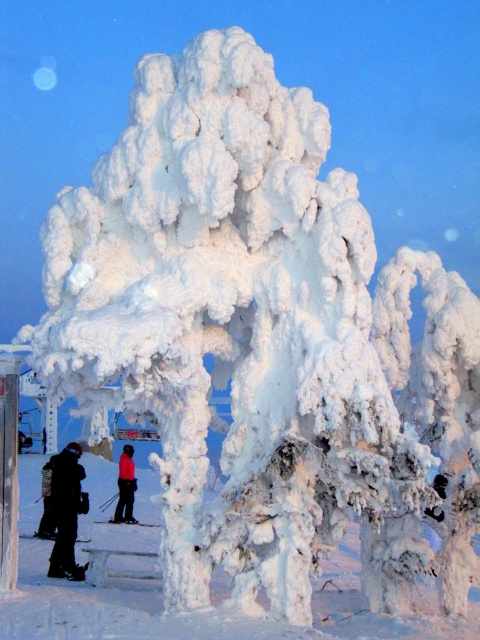
Which of these two, white frosty trees at center or black matte snowboarder at lower left, stands shorter?

With less height is black matte snowboarder at lower left.

Who is lower down, white frosty trees at center or black matte snowboarder at lower left?

white frosty trees at center is lower down.

Image resolution: width=480 pixels, height=640 pixels. Find the location of `white frosty trees at center`. white frosty trees at center is located at coordinates (204, 611).

Is point (74, 504) positioned before point (127, 461)?

Yes, point (74, 504) is in front of point (127, 461).

Which is above, black matte snowboarder at lower left or red fabric skier at center?

Positioned higher is black matte snowboarder at lower left.

The height and width of the screenshot is (640, 480). What do you see at coordinates (66, 509) in the screenshot? I see `black matte snowboarder at lower left` at bounding box center [66, 509].

Find the location of a particular element. Image resolution: width=480 pixels, height=640 pixels. black matte snowboarder at lower left is located at coordinates (66, 509).

Measure the distance between white frosty trees at center and camera.

They are 31.76 feet apart.

Is point (354, 616) farther from camera compared to point (124, 480)?

No, (354, 616) is closer to viewer.

This screenshot has height=640, width=480. What do you see at coordinates (204, 611) in the screenshot? I see `white frosty trees at center` at bounding box center [204, 611].

Where is `white frosty trees at center`? white frosty trees at center is located at coordinates (204, 611).